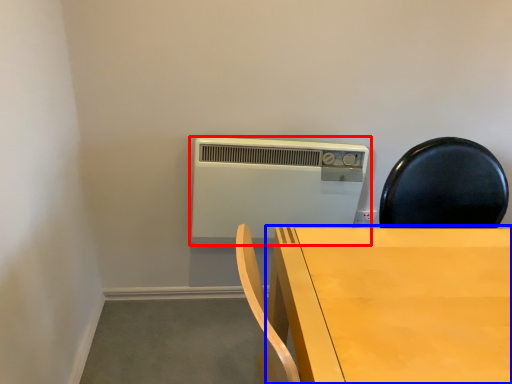
Question: Which point is closer to the camera, home appliance (highlighted by a red box) or table (highlighted by a blue box)?

Choices:
 (A) home appliance
 (B) table

Answer: (B)